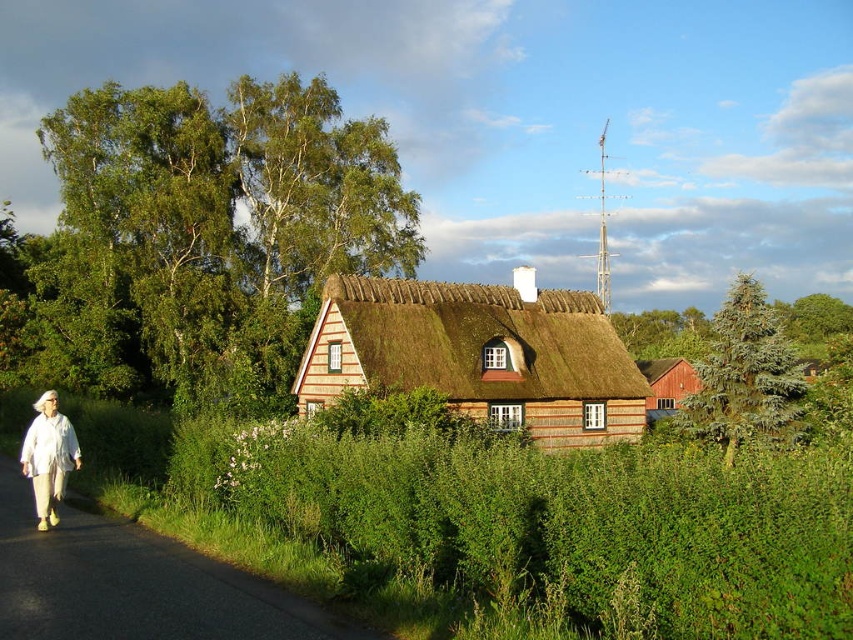
Is green asphalt road at lower left wider than white fabric pants at left?

Incorrect, green asphalt road at lower left's width does not surpass white fabric pants at left's.

Identify the location of green asphalt road at lower left. The image size is (853, 640). (132, 582).

Does brown thatch roof at center have a greater height compared to green asphalt road at lower left?

Yes.

Between point (419, 385) and point (312, 611), which one is positioned in front?

Point (312, 611)

Does point (541, 376) come closer to viewer compared to point (184, 604)?

No, it is not.

Identify the location of brown thatch roof at center. Image resolution: width=853 pixels, height=640 pixels. (479, 355).

Is white fabric pants at left bigger than red wood barn at center-right?

No.

Looking at this image, can you confirm if white fabric pants at left is shorter than red wood barn at center-right?

Yes.

Measure the distance between point (x=51, y=504) and camera.

42.00 feet

At what (x,y) coordinates should I click in order to perform the action: click on white fabric pants at left. Please return your answer as a coordinate pair (x, y). The width and height of the screenshot is (853, 640). Looking at the image, I should click on (48, 458).